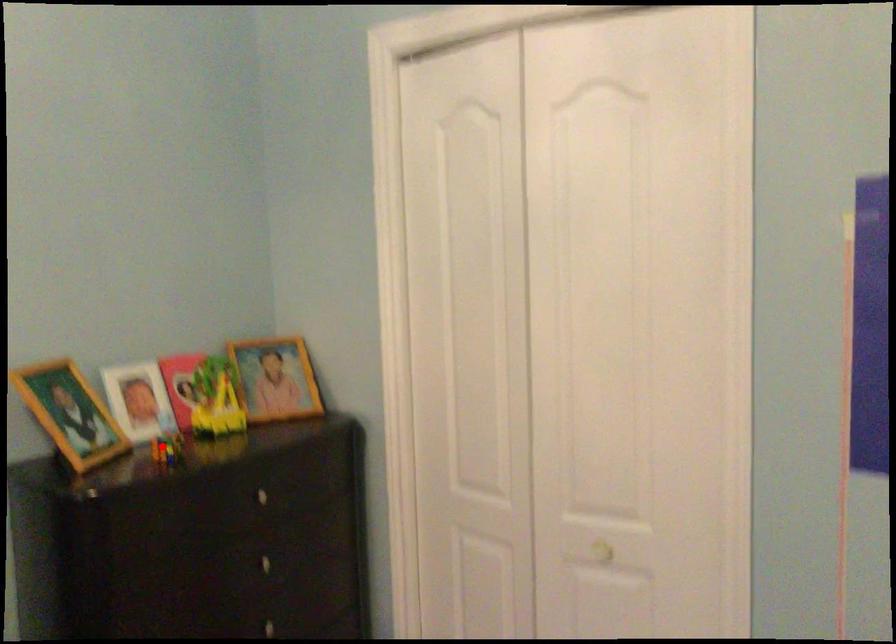
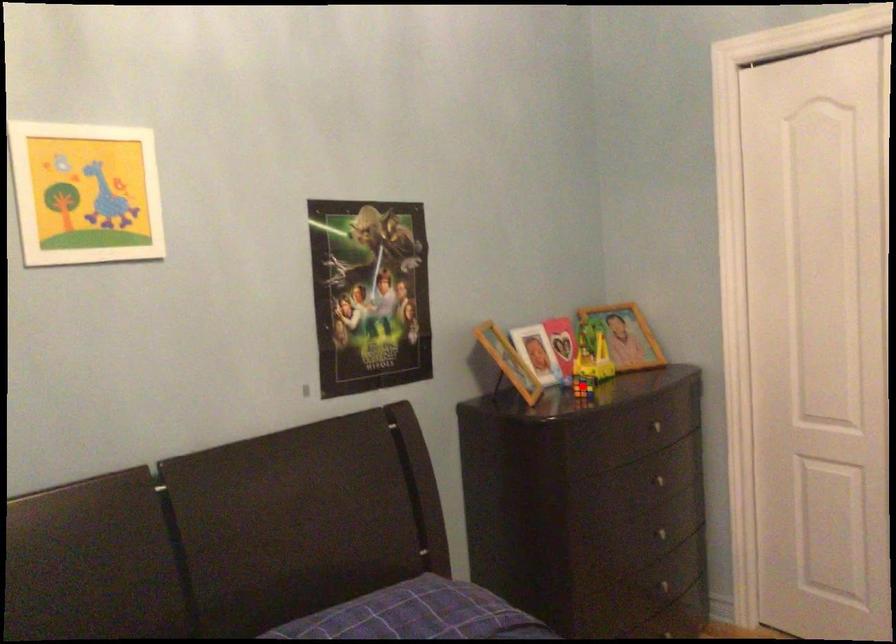
I am providing you with two images of the same scene from different viewpoints. A red point is marked on the first image and another point is marked on the second image. Do the highlighted points in image1 and image2 indicate the same real-world spot?

Yes